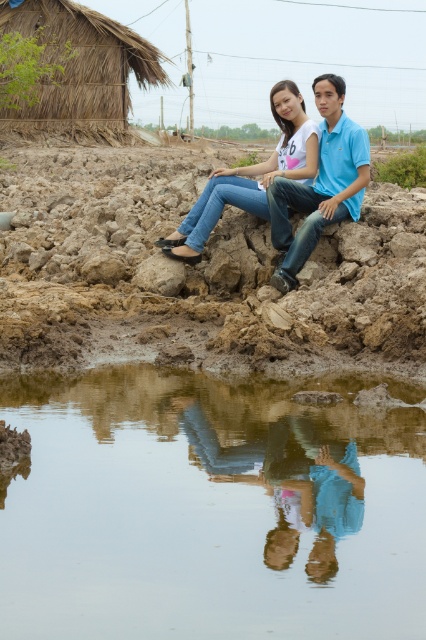
You are standing at the point marked by the coordinates point [81,67]. Looking towards the two people sitting on the cracked earth, which direction should you face to see them?

The thatched straw hut at upper left is represented by point [81,67]. Since the two people are sitting on the mound of dry, cracked earth near the body of water and the hut is on the left side of the image, you should face towards the right to see the people.

Looking at this image, you are standing at the origin point of the coordinate system. You want to walk to the transparent glass puddle at lower center. What direction should you go?

The transparent glass puddle at lower center is located at coordinate point (x=210, y=509), so you should move towards the right and forward to reach it.

Consider the image. You are taking a photo of two people sitting on a mound of dry, cracked earth. You need to focus your camera on both the point closer to you and the point further away. Which of the two points, point (57, 96) or point (259, 166), is closer to your camera?

Point (57, 96) is closer to the camera than point (259, 166).